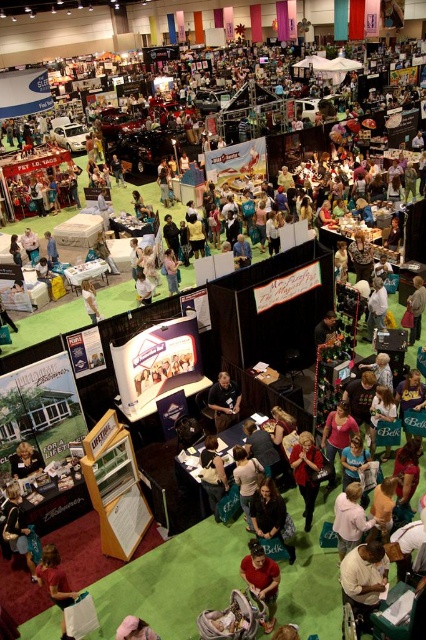
Question: Which point is farther to the camera?

Choices:
 (A) light brown leather jacket at center
 (B) golden hair at center
 (C) black leather jacket at center

Answer: (A)

Question: Does golden hair at center appear on the left side of dark green fabric bag at center?

Choices:
 (A) yes
 (B) no

Answer: (B)

Question: Which point appears closest to the camera in this image?

Choices:
 (A) (249, 582)
 (B) (350, 550)
 (C) (219, 518)

Answer: (A)

Question: Does golden hair at center come behind matte black shirt at lower left?

Choices:
 (A) yes
 (B) no

Answer: (A)

Question: Which object appears closest to the camera in this image?

Choices:
 (A) golden hair at center
 (B) dark green fabric bag at center
 (C) matte black jacket at lower left
 (D) light brown leather jacket at center

Answer: (A)

Question: Observing the image, what is the correct spatial positioning of golden hair at center in reference to light brown leather jacket at center?

Choices:
 (A) left
 (B) right

Answer: (B)